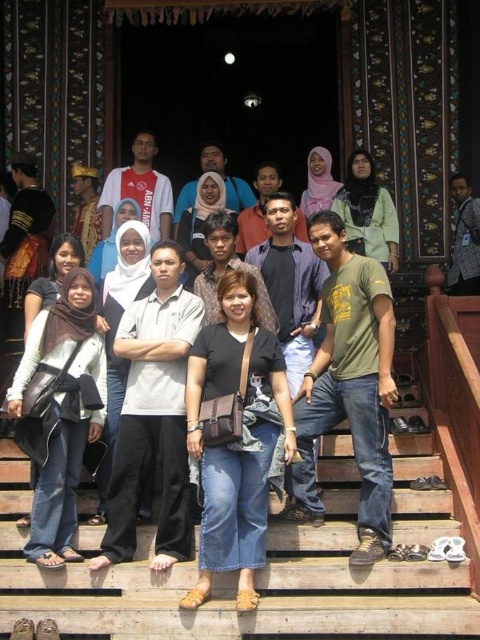
Who is positioned more to the right, wooden stairs at center or green matte t-shirt at center?

green matte t-shirt at center is more to the right.

Locate an element on the screen. This screenshot has height=640, width=480. wooden stairs at center is located at coordinates (235, 577).

The image size is (480, 640). Describe the element at coordinates (235, 577) in the screenshot. I see `wooden stairs at center` at that location.

Identify the location of wooden stairs at center. Image resolution: width=480 pixels, height=640 pixels. (235, 577).

Which of these two, wooden stairs at center or matte black shirt at center, stands shorter?

With less height is wooden stairs at center.

Between point (432, 486) and point (253, 604), which one is positioned behind?

The point (432, 486) is behind.

Does point (268, 627) lie in front of point (226, 474)?

That is True.

In order to click on wooden stairs at center in this screenshot , I will do `click(235, 577)`.

Looking at this image, which is more to the right, green matte t-shirt at center or matte black shirt at center?

Positioned to the right is green matte t-shirt at center.

Does point (384, 534) come behind point (290, 440)?

No, (384, 534) is closer to viewer.

I want to click on green matte t-shirt at center, so click(348, 385).